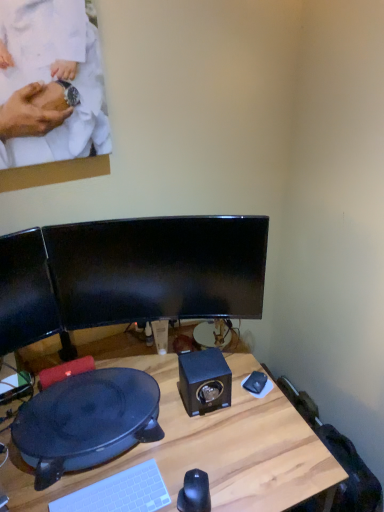
You are a GUI agent. You are given a task and a screenshot of the screen. Output one action in this format:
    pyautogui.click(x=<x>, y=<y>)
    Task: Click on the free area in between white plastic keyboard at lower center and black plastic wok at lower left
    This screenshot has height=512, width=384.
    Given the screenshot: What is the action you would take?
    pyautogui.click(x=110, y=476)